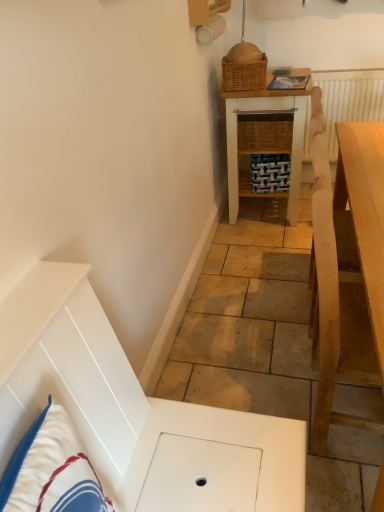
Where is `vacant space behind light wood table at right, placed as the first table when sorted from front to back`? This screenshot has height=512, width=384. vacant space behind light wood table at right, placed as the first table when sorted from front to back is located at coordinates (273, 350).